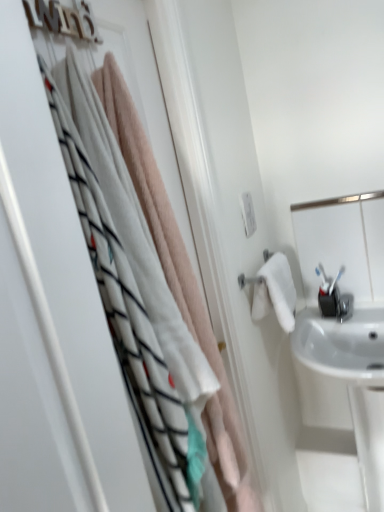
Question: Is white glossy sink at right to the left or to the right of white glossy mirror at upper right in the image?

Choices:
 (A) right
 (B) left

Answer: (A)

Question: Is white glossy sink at right taller or shorter than white glossy mirror at upper right?

Choices:
 (A) short
 (B) tall

Answer: (B)

Question: Which is farther from the white glossy sink at right?

Choices:
 (A) white glossy mirror at upper right
 (B) soft pink towel at upper left

Answer: (B)

Question: Which object is the farthest from the white glossy mirror at upper right?

Choices:
 (A) white glossy sink at right
 (B) soft pink towel at upper left

Answer: (B)